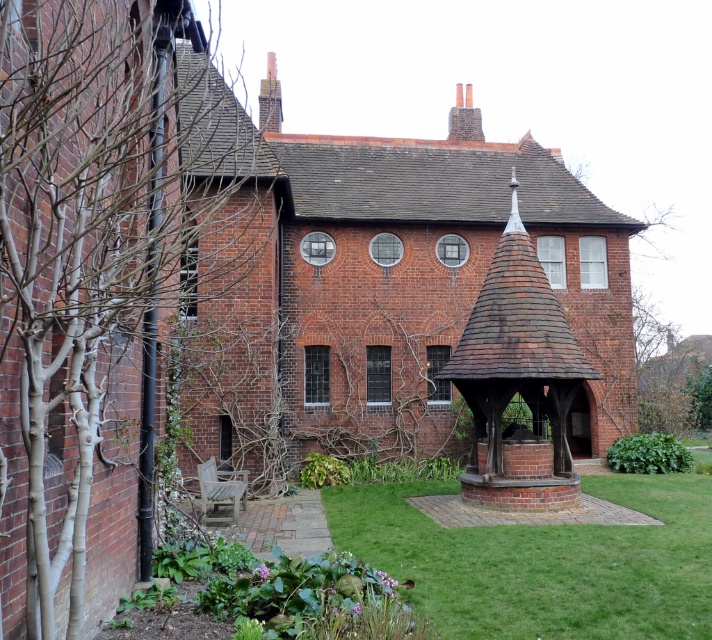
Question: Does green grass at center appear on the left side of brown wooden gazebo at center?

Choices:
 (A) yes
 (B) no

Answer: (A)

Question: Which point is closer to the camera?

Choices:
 (A) brown wooden gazebo at center
 (B) green grass at center

Answer: (B)

Question: Which point is farther from the camera taking this photo?

Choices:
 (A) (549, 460)
 (B) (538, 550)

Answer: (A)

Question: Is green grass at center closer to camera compared to brown wooden gazebo at center?

Choices:
 (A) yes
 (B) no

Answer: (A)

Question: Is the position of green grass at center more distant than that of brown wooden gazebo at center?

Choices:
 (A) no
 (B) yes

Answer: (A)